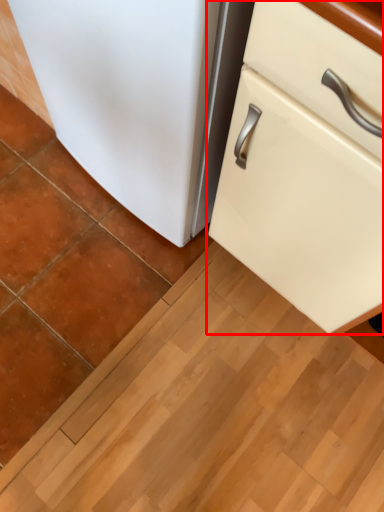
Question: From the image's perspective, where is cabinetry (annotated by the red box) located relative to refrigerator?

Choices:
 (A) below
 (B) above

Answer: (A)